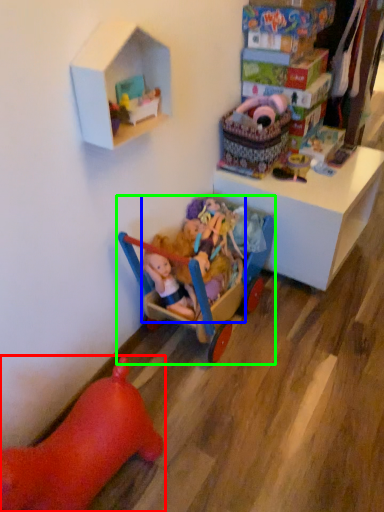
Question: Estimate the real-world distances between objects in this image. Which object is farther from toy (highlighted by a red box), toy (highlighted by a blue box) or toy (highlighted by a green box)?

Choices:
 (A) toy
 (B) toy

Answer: (A)